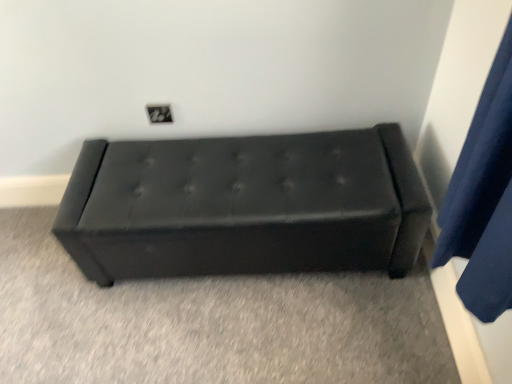
What is the approximate height of black leather ottoman at center?

It is 16.87 inches.

The width and height of the screenshot is (512, 384). I want to click on black leather ottoman at center, so click(x=245, y=206).

Describe the element at coordinates (245, 206) in the screenshot. I see `black leather ottoman at center` at that location.

You are a GUI agent. You are given a task and a screenshot of the screen. Output one action in this format:
    pyautogui.click(x=<x>, y=<y>)
    Task: Click on the black leather ottoman at center
    The image size is (512, 384).
    Given the screenshot: What is the action you would take?
    coord(245,206)